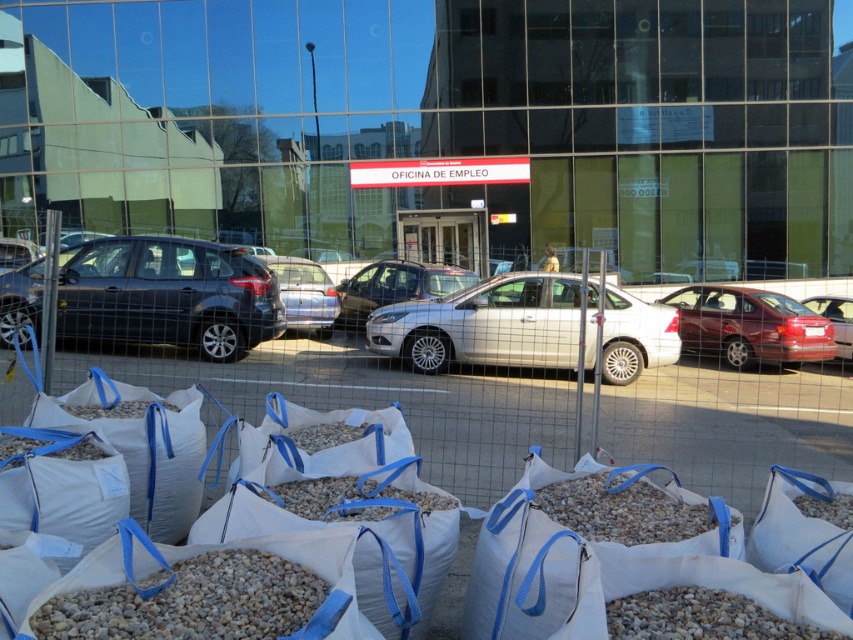
Is matte silver sedan at center to the left of matte black hatchback at left from the viewer's perspective?

In fact, matte silver sedan at center is to the right of matte black hatchback at left.

Who is shorter, matte silver sedan at center or matte black hatchback at left?

With less height is matte black hatchback at left.

Which is behind, point (202, 276) or point (207, 314)?

The point (207, 314) is behind.

This screenshot has width=853, height=640. I want to click on matte silver sedan at center, so (167, 294).

Is gray gravel at lower left taller than shiny red sedan at right?

No.

Is the position of gray gravel at lower left more distant than that of shiny red sedan at right?

No.

Describe the element at coordinates (190, 602) in the screenshot. I see `gray gravel at lower left` at that location.

Find the location of a particular element. This screenshot has height=640, width=853. gray gravel at lower left is located at coordinates (190, 602).

Is white metallic car at center shorter than shiny red sedan at right?

No, white metallic car at center is not shorter than shiny red sedan at right.

Is white metallic car at center above shiny red sedan at right?

No.

Between point (640, 365) and point (744, 289), which one is positioned behind?

Positioned behind is point (744, 289).

This screenshot has height=640, width=853. I want to click on white metallic car at center, so click(485, 324).